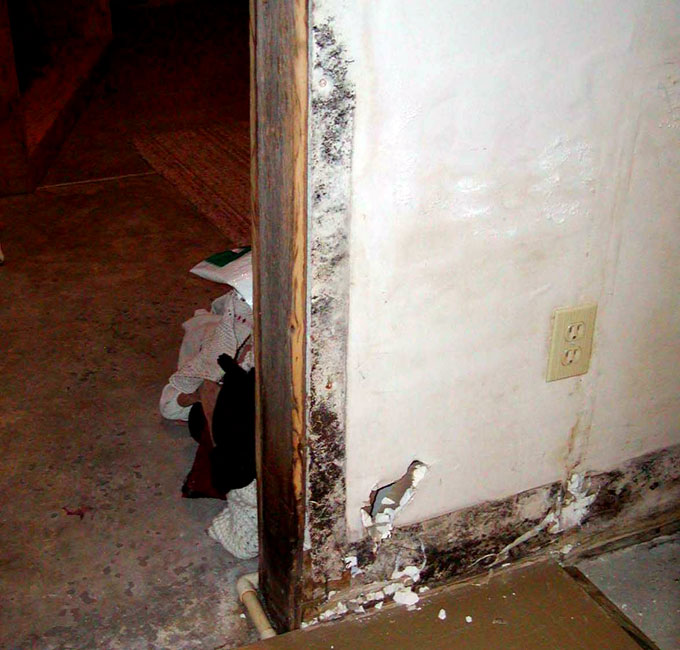
Image resolution: width=680 pixels, height=650 pixels. In order to click on wall behind baseboard after removal in this screenshot , I will do coord(477,526), coord(638,494), coord(368,561).